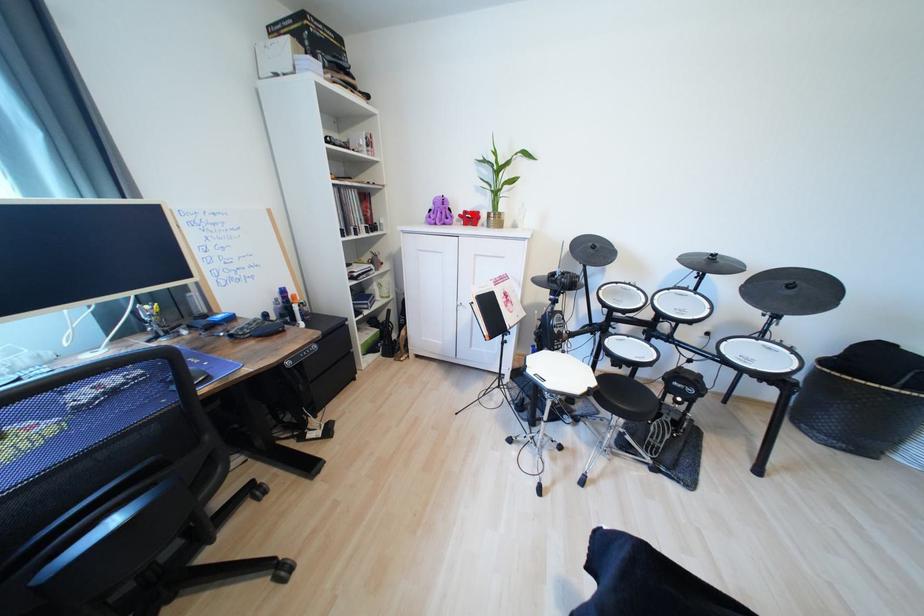
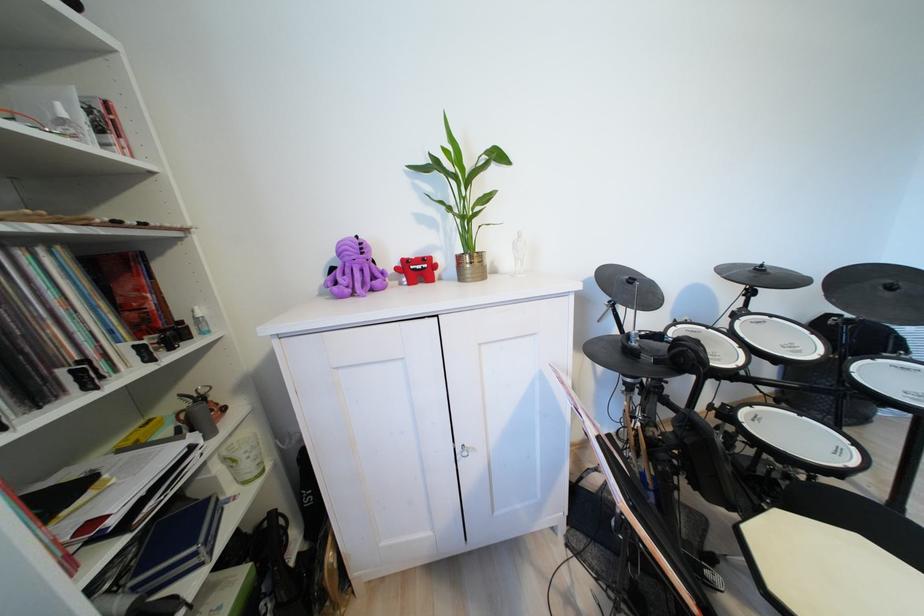
Locate, in the second image, the point that corresponds to the highlighted location in the first image.

(411, 262)